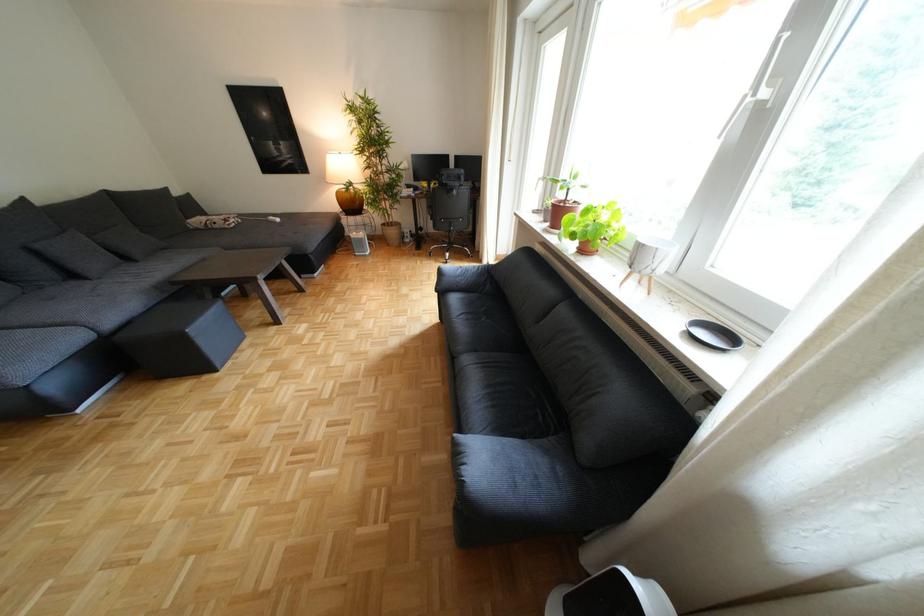
Where is `white window handle`? This screenshot has width=924, height=616. white window handle is located at coordinates (769, 73).